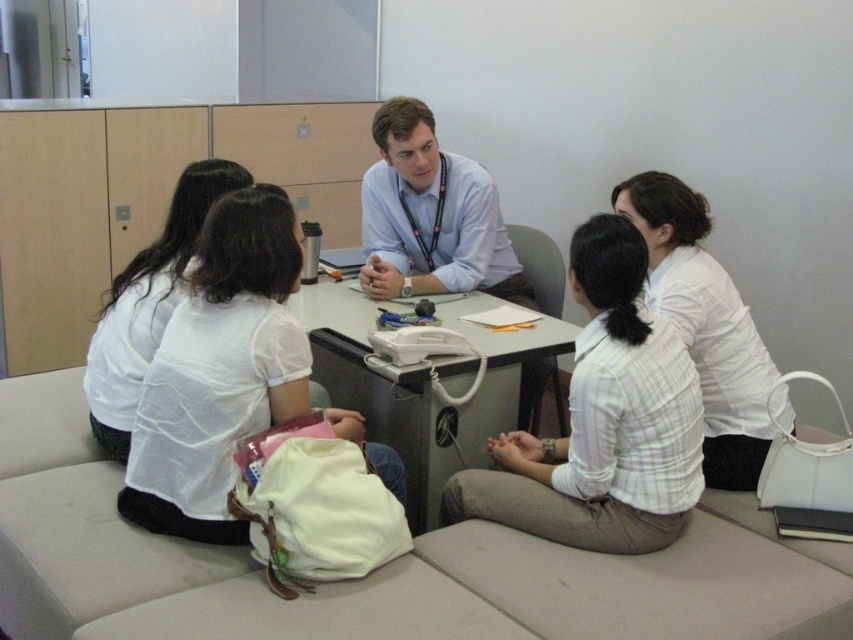
Question: Does white textured shirt at right appear under blue shirt at center?

Choices:
 (A) yes
 (B) no

Answer: (A)

Question: Does white checkered shirt at center have a larger size compared to white matte backpack at lower left?

Choices:
 (A) no
 (B) yes

Answer: (B)

Question: Which point is farther to the camera?

Choices:
 (A) white checkered shirt at center
 (B) blue shirt at center
 (C) white matte backpack at lower left

Answer: (B)

Question: From the image, what is the correct spatial relationship of white matte backpack at lower left in relation to white textured shirt at right?

Choices:
 (A) above
 (B) below

Answer: (B)

Question: Which object is the closest to the white matte backpack at lower left?

Choices:
 (A) blue shirt at center
 (B) white checkered shirt at center
 (C) white textured shirt at right
 (D) white plastic table at center

Answer: (D)

Question: Which point is farther to the camera?

Choices:
 (A) white fabric shirt at left
 (B) white checkered shirt at center
 (C) blue shirt at center

Answer: (C)